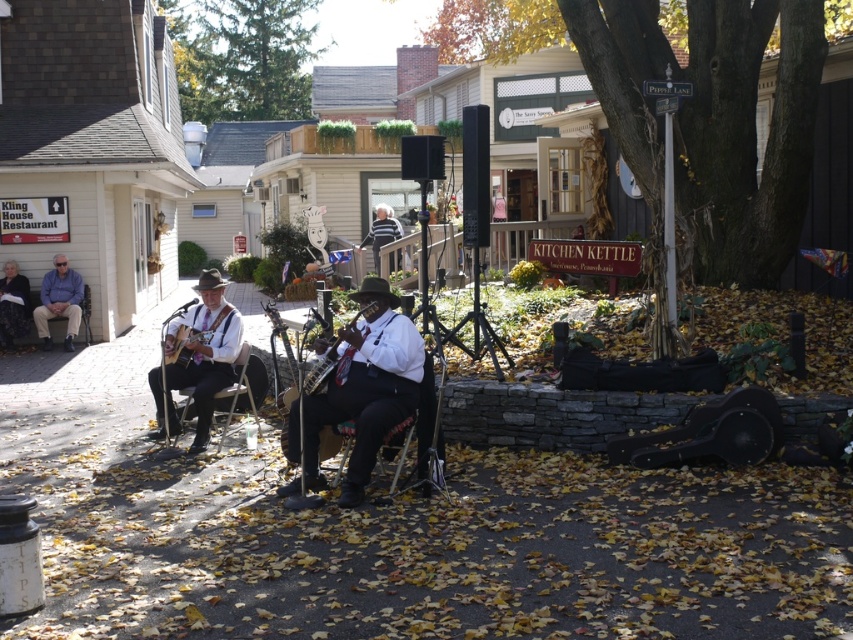
Can you confirm if matte blue shirt at left is positioned to the left of wooden acoustic guitar at center?

Correct, you'll find matte blue shirt at left to the left of wooden acoustic guitar at center.

Which is above, matte blue shirt at left or wooden acoustic guitar at center?

matte blue shirt at left is above.

Is point (71, 337) closer to viewer compared to point (312, 385)?

No, it is behind (312, 385).

Find the location of a particular element. The width and height of the screenshot is (853, 640). matte blue shirt at left is located at coordinates (59, 301).

Between point (368, 458) and point (206, 340), which one is positioned in front?

Point (368, 458) is more forward.

Is matte brown guitar at center to the right of wooden acoustic guitar at left from the viewer's perspective?

Correct, you'll find matte brown guitar at center to the right of wooden acoustic guitar at left.

Locate an element on the screen. The image size is (853, 640). matte brown guitar at center is located at coordinates (358, 390).

Identify the location of matte brown guitar at center. (358, 390).

Who is taller, matte brown guitar at center or matte black guitar at left?

matte black guitar at left

Is matte brown guitar at center to the right of matte black guitar at left from the viewer's perspective?

Correct, you'll find matte brown guitar at center to the right of matte black guitar at left.

Between point (323, 420) and point (225, 308), which one is positioned behind?

Positioned behind is point (225, 308).

The width and height of the screenshot is (853, 640). In order to click on matte brown guitar at center in this screenshot , I will do `click(358, 390)`.